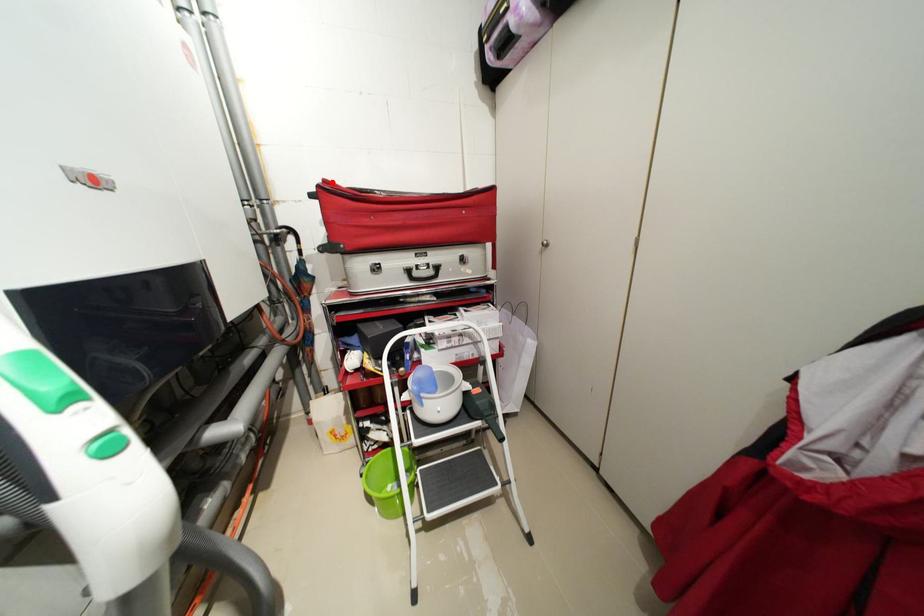
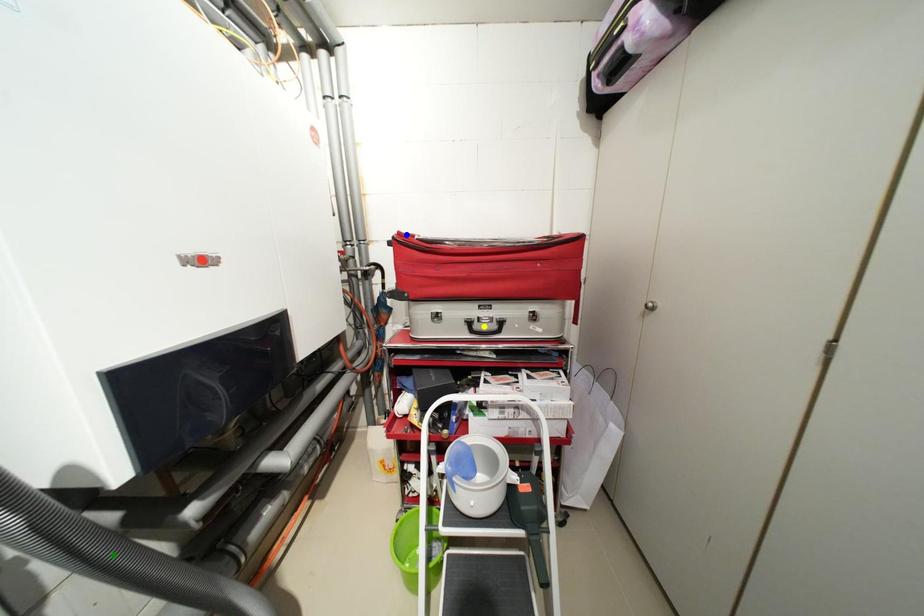
Question: I am providing you with two images of the same scene from different viewpoints. A red point is marked on the first image. You are given multiple points on the second image. Can you choose the point in image 2 that corresponds to the point in image 1?

Choices:
 (A) green point
 (B) blue point
 (C) yellow point

Answer: (B)